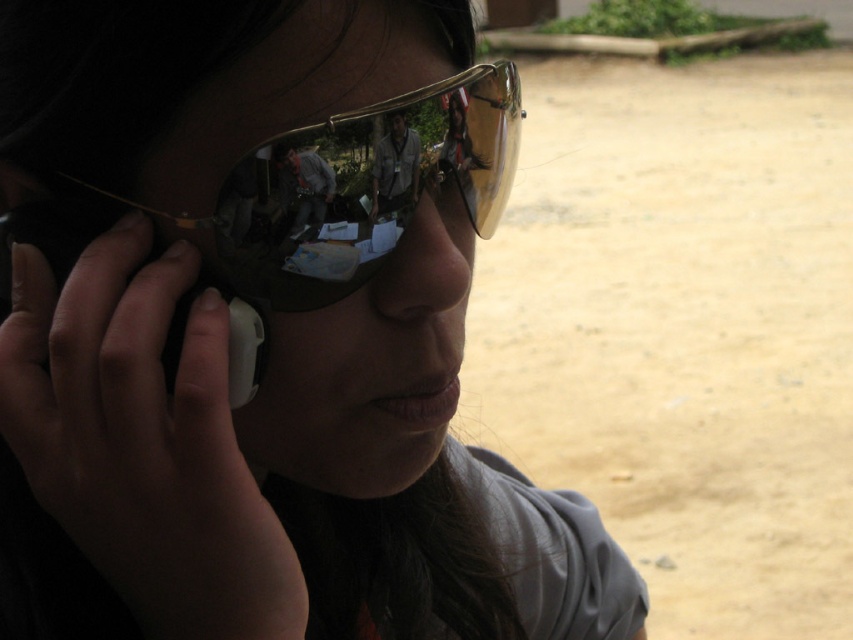
You are a photographer trying to capture a close shot of the gold reflective sunglasses at center and the black plastic smartphone at left. Which object should you zoom in on to ensure they both fit in the frame without cropping?

The gold reflective sunglasses at center are wider than the black plastic smartphone at left, so you should zoom in on the black plastic smartphone at left to ensure both objects fit in the frame without cropping.

You are a photographer trying to capture the gold reflective sunglasses at center in a portrait. The sunglasses are positioned at coordinates 0.292, 0.420. To ensure they are centered in the frame, should you adjust the camera to the left or right? Please explain your reasoning based on the provided coordinates.

The gold reflective sunglasses at center are already positioned at coordinates (357, 186). Since the center of the frame is typically at coordinates (426, 320), the sunglasses are slightly to the left and above the true center. To center them, you should move the camera slightly to the right and down.